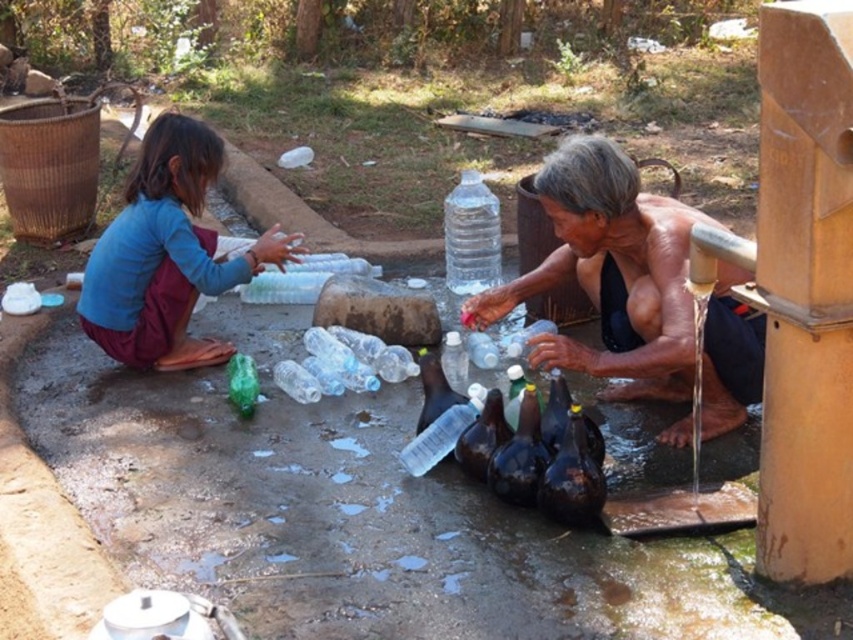
Question: Which point appears farthest from the camera in this image?

Choices:
 (A) (683, 224)
 (B) (149, 353)
 (C) (457, 344)

Answer: (B)

Question: Which point is closer to the camera?

Choices:
 (A) translucent plastic bottle at center
 (B) blue fabric pants at left
 (C) translucent plastic bottle at lower center

Answer: (C)

Question: Does translucent plastic bottle at lower center appear on the right side of blue fabric pants at left?

Choices:
 (A) yes
 (B) no

Answer: (A)

Question: Is translucent plastic bottle at lower center smaller than blue fabric pants at left?

Choices:
 (A) no
 (B) yes

Answer: (A)

Question: Does translucent plastic bottle at lower center appear over translucent plastic bottle at center?

Choices:
 (A) yes
 (B) no

Answer: (A)

Question: Which of the following is the closest to the observer?

Choices:
 (A) blue fabric pants at left
 (B) translucent plastic bottle at lower center

Answer: (B)